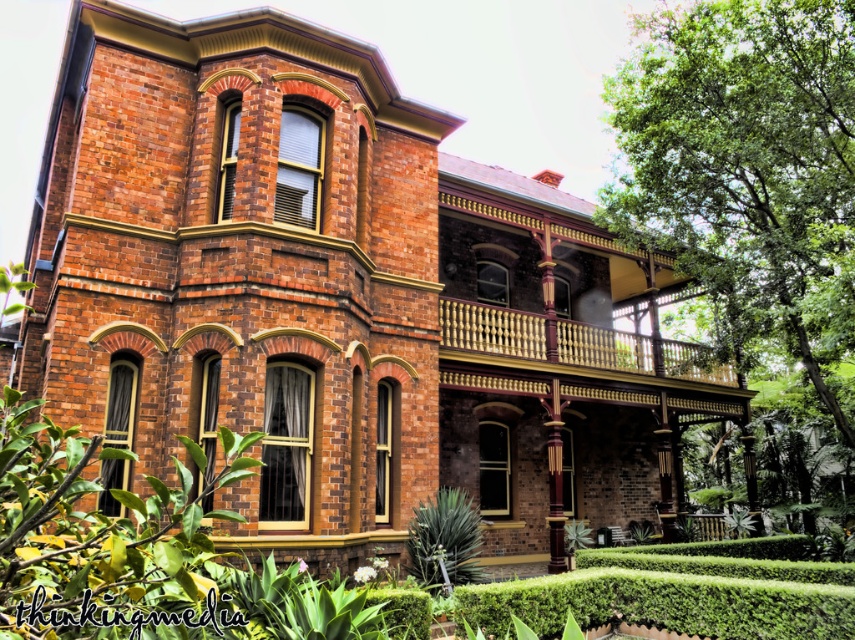
You are standing in front of the historic brick house and notice two green plants. One is the green leafy tree at right and the other is the green leafy hedge at lower center. Which one is positioned more to the right side?

The green leafy tree at right is positioned more to the right side than the green leafy hedge at lower center.

You are standing in front of the historic brick house and want to know the distance to a specific point marked at coordinates point (x=680, y=236). Can you tell me how far that point is from where you are standing?

The point (x=680, y=236) is 12.48 meters away from the viewer, so the distance is 12.48 meters.

Consider the image. Based on the scene of the historic brick house with Victorian architecture, there is a point labeled as point (747, 170). What object is located at that specific coordinate?

The green leafy tree at right is located at point (747, 170).